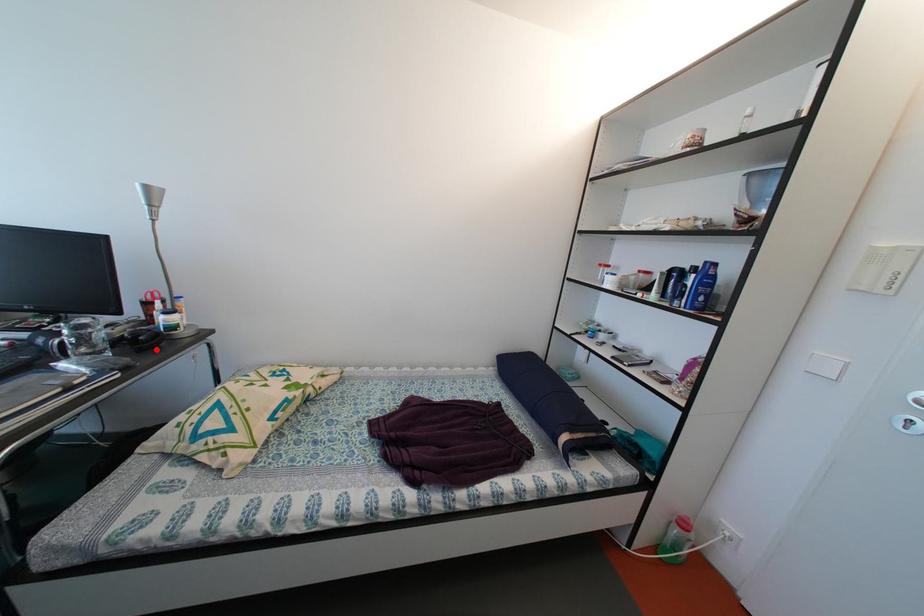
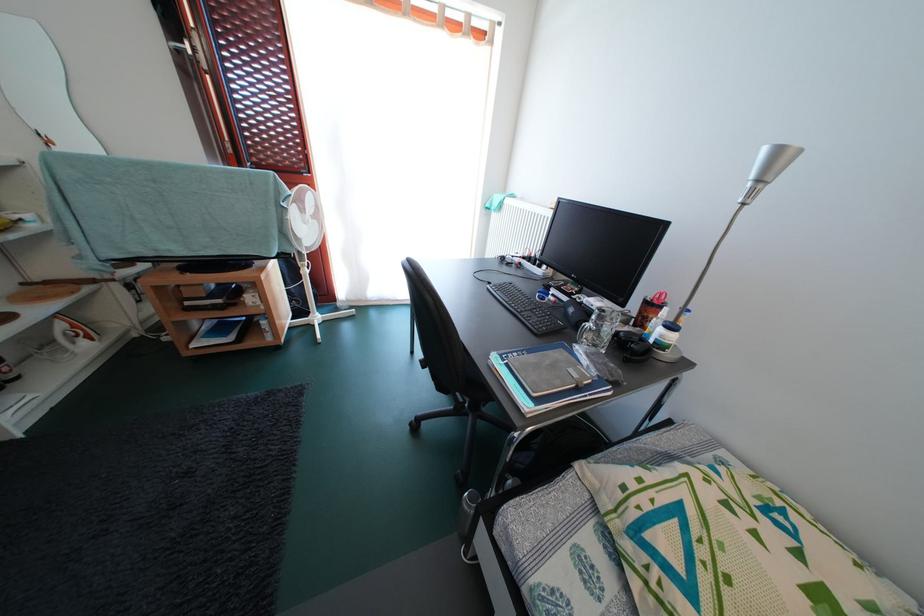
In the second image, find the point that corresponds to the highlighted location in the first image.

(640, 360)